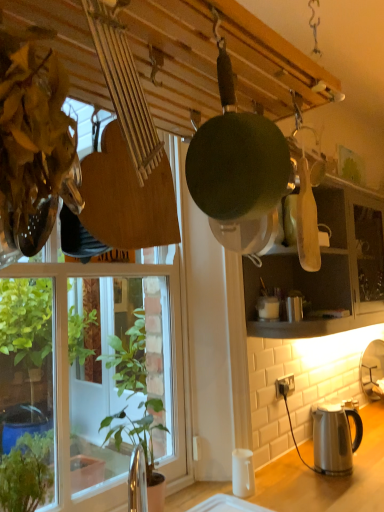
Question: From a real-world perspective, is satin silver kettle at lower right located higher than white matte coffee cup at lower right?

Choices:
 (A) yes
 (B) no

Answer: (A)

Question: Does satin silver kettle at lower right touch white matte coffee cup at lower right?

Choices:
 (A) yes
 (B) no

Answer: (B)

Question: Is satin silver kettle at lower right located outside white matte coffee cup at lower right?

Choices:
 (A) yes
 (B) no

Answer: (A)

Question: Is satin silver kettle at lower right thinner than white matte coffee cup at lower right?

Choices:
 (A) yes
 (B) no

Answer: (B)

Question: Is satin silver kettle at lower right taller than white matte coffee cup at lower right?

Choices:
 (A) no
 (B) yes

Answer: (B)

Question: From a real-world perspective, is transparent glass window at upper left physically located above or below white plastic power outlet at lower right?

Choices:
 (A) below
 (B) above

Answer: (B)

Question: Based on their sizes in the image, would you say transparent glass window at upper left is bigger or smaller than white plastic power outlet at lower right?

Choices:
 (A) big
 (B) small

Answer: (A)

Question: In terms of width, does transparent glass window at upper left look wider or thinner when compared to white plastic power outlet at lower right?

Choices:
 (A) wide
 (B) thin

Answer: (A)

Question: From the image's perspective, is transparent glass window at upper left positioned above or below white plastic power outlet at lower right?

Choices:
 (A) below
 (B) above

Answer: (B)

Question: Considering the positions of green matte frying pan at center and green leafy plant at lower left, which appears as the first houseplant when viewed from the left, in the image, is green matte frying pan at center wider or thinner than green leafy plant at lower left, which appears as the first houseplant when viewed from the left,?

Choices:
 (A) thin
 (B) wide

Answer: (B)

Question: From a real-world perspective, relative to green leafy plant at lower left, the second houseplant when ordered from back to front, is green matte frying pan at center vertically above or below?

Choices:
 (A) above
 (B) below

Answer: (A)

Question: In terms of height, does green matte frying pan at center look taller or shorter compared to green leafy plant at lower left, which appears as the 2th houseplant when viewed from the right?

Choices:
 (A) short
 (B) tall

Answer: (B)

Question: Is green matte frying pan at center inside the boundaries of green leafy plant at lower left, the second houseplant when ordered from back to front, or outside?

Choices:
 (A) outside
 (B) inside

Answer: (A)

Question: Relative to white plastic power outlet at lower right, is green leafy plant at lower left, which appears as the 2th houseplant when viewed from the right, in front or behind?

Choices:
 (A) front
 (B) behind

Answer: (A)

Question: Considering the positions of green leafy plant at lower left, acting as the first houseplant starting from the front, and white plastic power outlet at lower right in the image, is green leafy plant at lower left, acting as the first houseplant starting from the front, bigger or smaller than white plastic power outlet at lower right?

Choices:
 (A) big
 (B) small

Answer: (A)